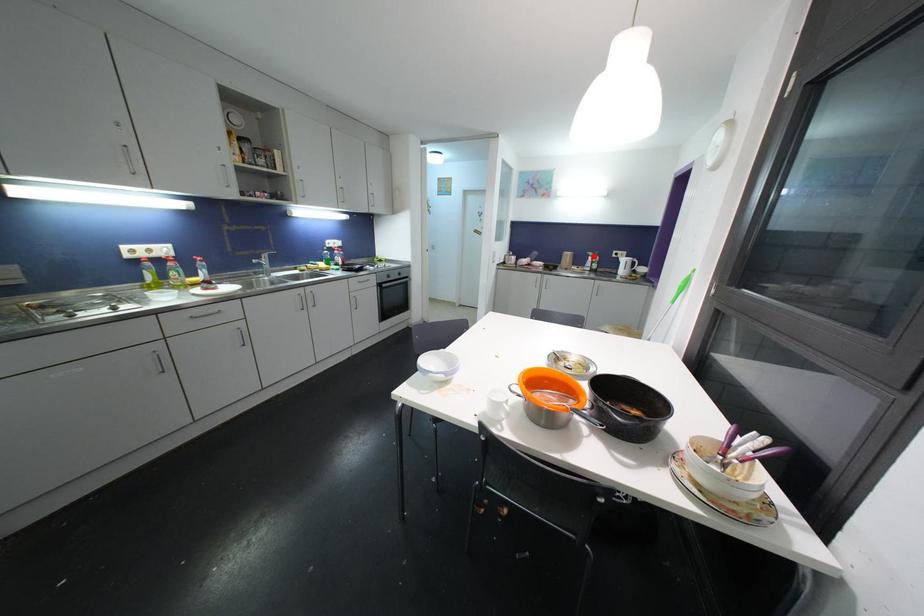
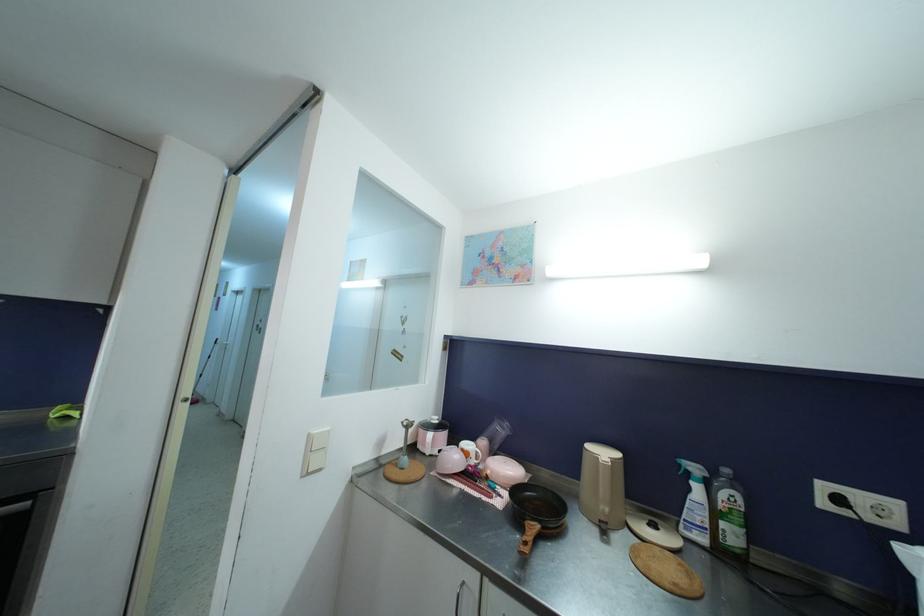
Question: I am providing you with two images of the same scene from different viewpoints. Given a red point in image1, look at the same physical point in image2. Is it:

Choices:
 (A) Closer to the viewpoint
 (B) Farther from the viewpoint

Answer: (B)